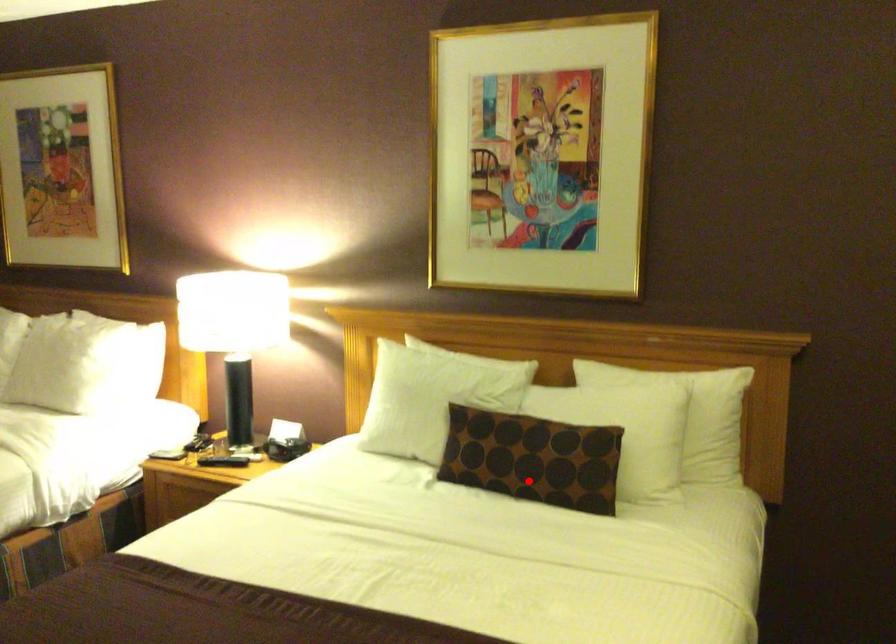
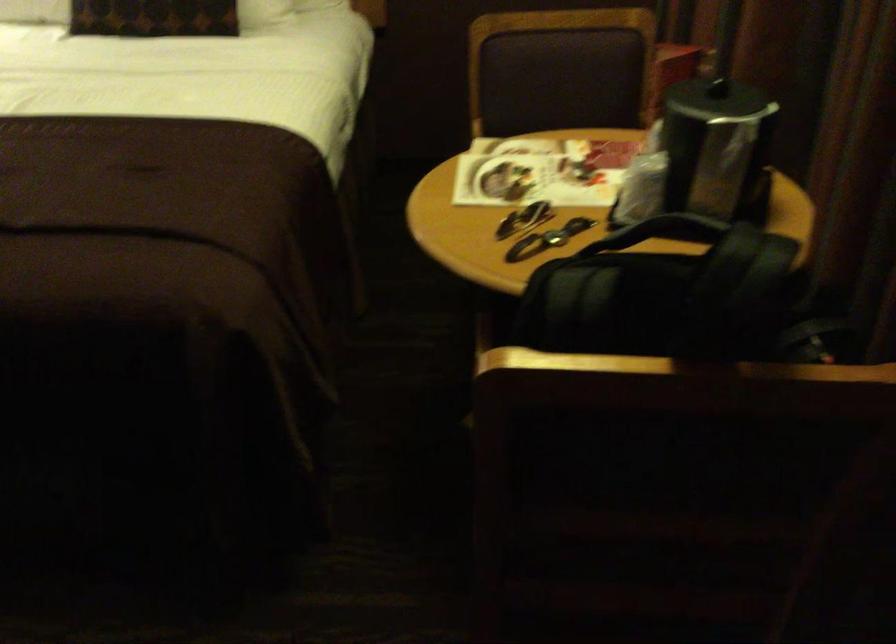
Question: I am providing you with two images of the same scene from different viewpoints. A red point is marked on the first image. Can you still see the location of the red point in image 2?

Choices:
 (A) Yes
 (B) No

Answer: (A)